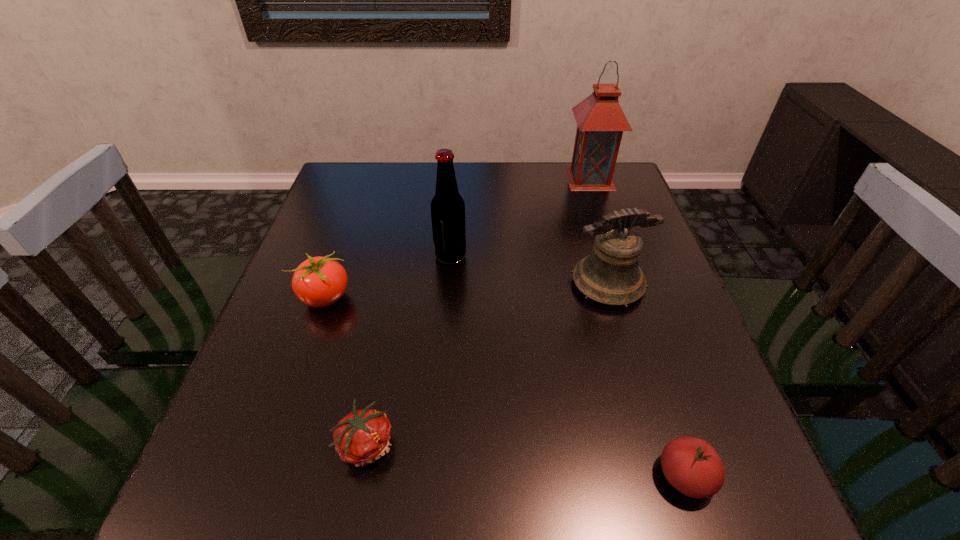
Identify the location of vacant region that satisfies the following two spatial constraints: 1. on the front side of the third tallest object; 2. on the right side of the second tallest object. (448, 285).